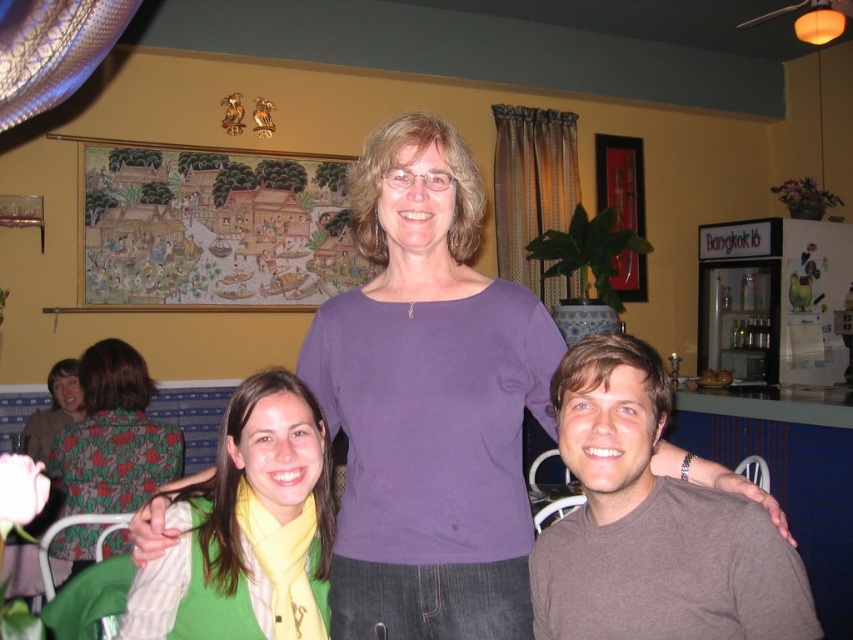
Question: Which of these objects is positioned farthest from the green matte scarf at center?

Choices:
 (A) purple smooth shirt at center
 (B) floral fabric dress at left
 (C) floral fabric shirt at left
 (D) brown cotton shirt at center

Answer: (C)

Question: Where is floral fabric dress at left located in relation to floral fabric shirt at left in the image?

Choices:
 (A) right
 (B) left

Answer: (A)

Question: Is purple smooth shirt at center to the left of brown cotton shirt at center from the viewer's perspective?

Choices:
 (A) yes
 (B) no

Answer: (A)

Question: Which point is closer to the camera taking this photo?

Choices:
 (A) (38, 444)
 (B) (457, 365)
 (C) (236, 387)

Answer: (B)

Question: Is brown cotton shirt at center smaller than floral fabric dress at left?

Choices:
 (A) yes
 (B) no

Answer: (A)

Question: Which of the following is the closest to the observer?

Choices:
 (A) (683, 605)
 (B) (50, 372)
 (C) (312, 500)

Answer: (A)